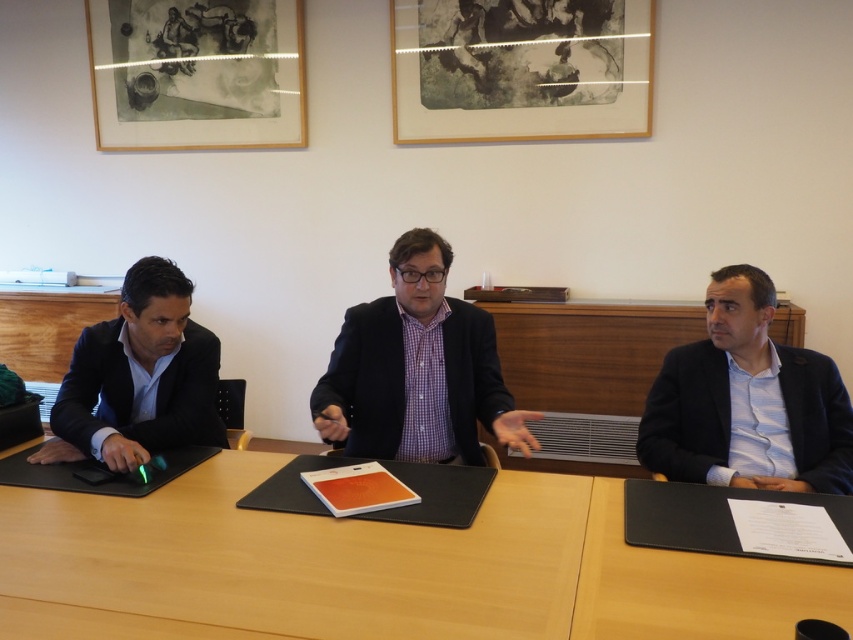
Can you confirm if matte wooden picture frame at upper left is positioned to the right of dark blue textured suit at center?

No, matte wooden picture frame at upper left is not to the right of dark blue textured suit at center.

You are a GUI agent. You are given a task and a screenshot of the screen. Output one action in this format:
    pyautogui.click(x=<x>, y=<y>)
    Task: Click on the matte wooden picture frame at upper left
    This screenshot has height=640, width=853.
    Given the screenshot: What is the action you would take?
    pyautogui.click(x=196, y=74)

The height and width of the screenshot is (640, 853). I want to click on matte wooden picture frame at upper left, so click(x=196, y=74).

Is wooden picture frame at upper center bigger than dark blue textured suit at center?

Yes.

Can you confirm if wooden picture frame at upper center is positioned above dark blue textured suit at center?

Indeed, wooden picture frame at upper center is positioned over dark blue textured suit at center.

Does point (415, 28) lie in front of point (485, 412)?

No, it is behind (485, 412).

You are a GUI agent. You are given a task and a screenshot of the screen. Output one action in this format:
    pyautogui.click(x=<x>, y=<y>)
    Task: Click on the wooden picture frame at upper center
    
    Given the screenshot: What is the action you would take?
    520,68

From the picture: Which is more to the right, black matte suit at right or dark blue textured suit at center?

black matte suit at right is more to the right.

Is black matte suit at right below dark blue textured suit at center?

Yes, black matte suit at right is below dark blue textured suit at center.

Image resolution: width=853 pixels, height=640 pixels. In order to click on black matte suit at right in this screenshot , I will do `click(747, 419)`.